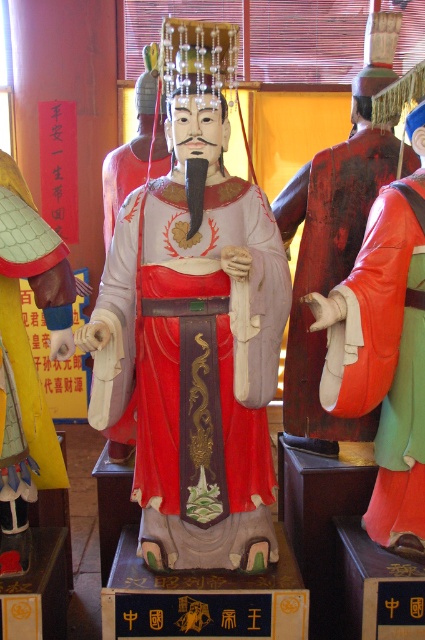
Which is above, matte wood statue at center or leather-like red robe at right?

matte wood statue at center

This screenshot has width=425, height=640. Find the location of `matte wood statue at center`. matte wood statue at center is located at coordinates (195, 328).

Based on the photo, between matte wood statue at center and reddish-brown leather robe at right, which one has more height?

Standing taller between the two is matte wood statue at center.

Is point (163, 243) closer to viewer compared to point (362, 102)?

Yes.

From the picture: Measure the distance between matte wood statue at center and camera.

matte wood statue at center is 6.30 feet away from camera.

At what (x,y) coordinates should I click in order to perform the action: click on matte wood statue at center. Please return your answer as a coordinate pair (x, y). This screenshot has height=640, width=425. Looking at the image, I should click on (195, 328).

Does leather-like red robe at right lie in front of reddish-brown leather robe at right?

Yes, it is in front of reddish-brown leather robe at right.

Which is more to the right, leather-like red robe at right or reddish-brown leather robe at right?

Positioned to the right is leather-like red robe at right.

Which is in front, point (408, 333) or point (331, 173)?

Point (408, 333) is more forward.

Find the location of a particular element. leather-like red robe at right is located at coordinates (390, 356).